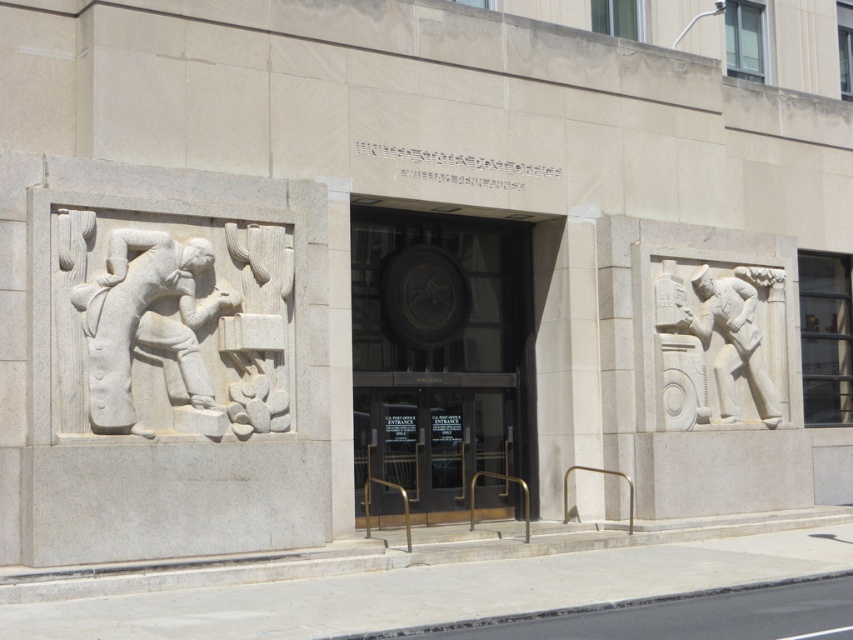
Question: Which point is farther to the camera?

Choices:
 (A) polished bronze door at center
 (B) white stone figure at right
 (C) white stone figure at left

Answer: (B)

Question: Which point is farther from the camera taking this photo?

Choices:
 (A) (432, 260)
 (B) (107, 339)
 (C) (718, 307)

Answer: (C)

Question: Does polished bronze door at center appear on the right side of white stone figure at right?

Choices:
 (A) no
 (B) yes

Answer: (A)

Question: Does polished bronze door at center have a smaller size compared to white stone figure at left?

Choices:
 (A) yes
 (B) no

Answer: (B)

Question: Does white stone figure at left come behind white stone figure at right?

Choices:
 (A) yes
 (B) no

Answer: (B)

Question: Which point is closer to the camera?

Choices:
 (A) polished bronze door at center
 (B) white stone figure at left
 (C) white stone figure at right

Answer: (B)